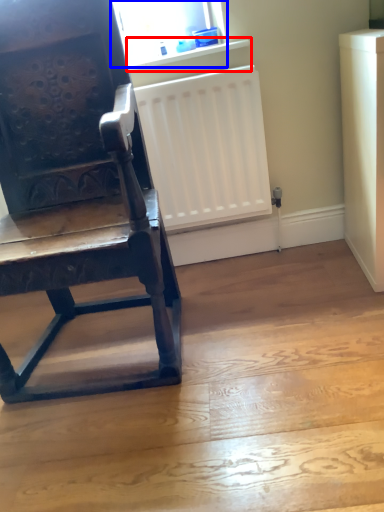
Question: Which point is further to the camera, window sill (highlighted by a red box) or window screen (highlighted by a blue box)?

Choices:
 (A) window sill
 (B) window screen

Answer: (A)